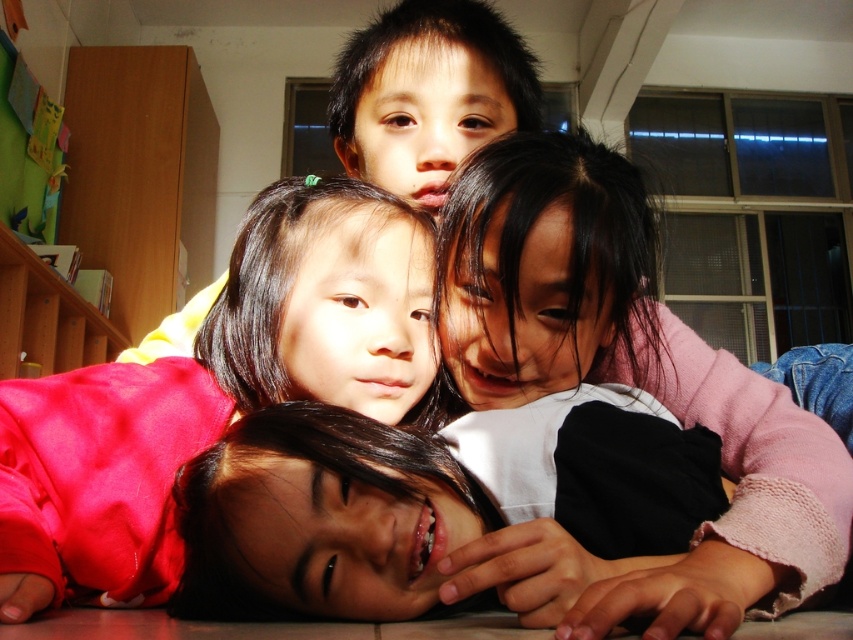
Looking at this image, is smooth pink sweater at center thinner than smooth skin face at upper center?

Incorrect, smooth pink sweater at center's width is not less than smooth skin face at upper center's.

Is point (227, 369) farther from camera compared to point (364, 67)?

That is False.

Is point (173, 426) positioned after point (526, 52)?

No, (173, 426) is in front of (526, 52).

Locate an element on the screen. Image resolution: width=853 pixels, height=640 pixels. smooth pink sweater at center is located at coordinates (213, 387).

The height and width of the screenshot is (640, 853). Describe the element at coordinates (581, 342) in the screenshot. I see `smooth skin child at center` at that location.

Is smooth skin child at center positioned at the back of smooth skin face at upper center?

No, smooth skin child at center is closer to the viewer.

The image size is (853, 640). I want to click on smooth skin child at center, so click(581, 342).

Which is behind, point (190, 593) or point (6, 416)?

Point (6, 416)

Where is `smooth skin child at center`? The height and width of the screenshot is (640, 853). smooth skin child at center is located at coordinates (581, 342).

Does point (485, 196) come closer to viewer compared to point (125, 538)?

No, (485, 196) is further to viewer.

Where is `smooth skin child at center`? This screenshot has height=640, width=853. smooth skin child at center is located at coordinates (581, 342).